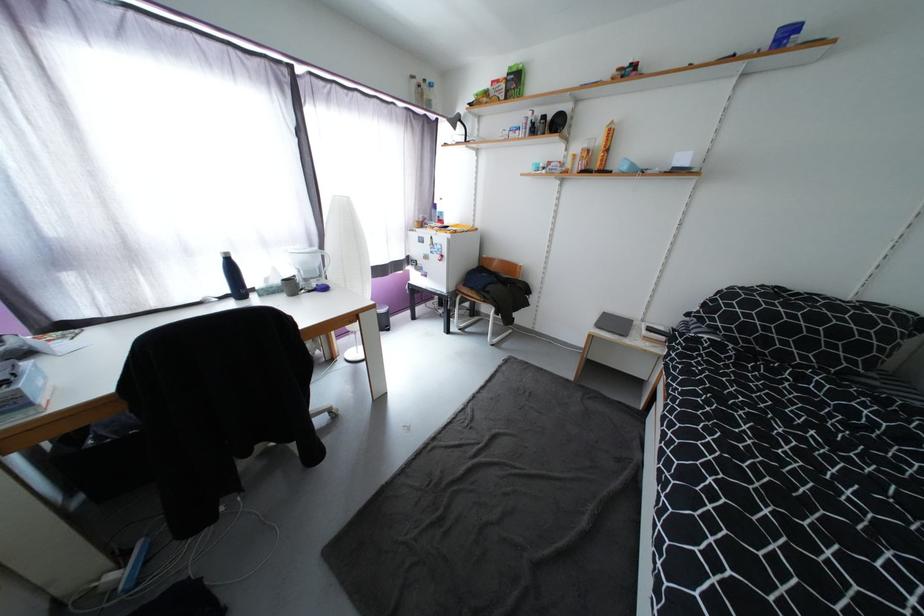
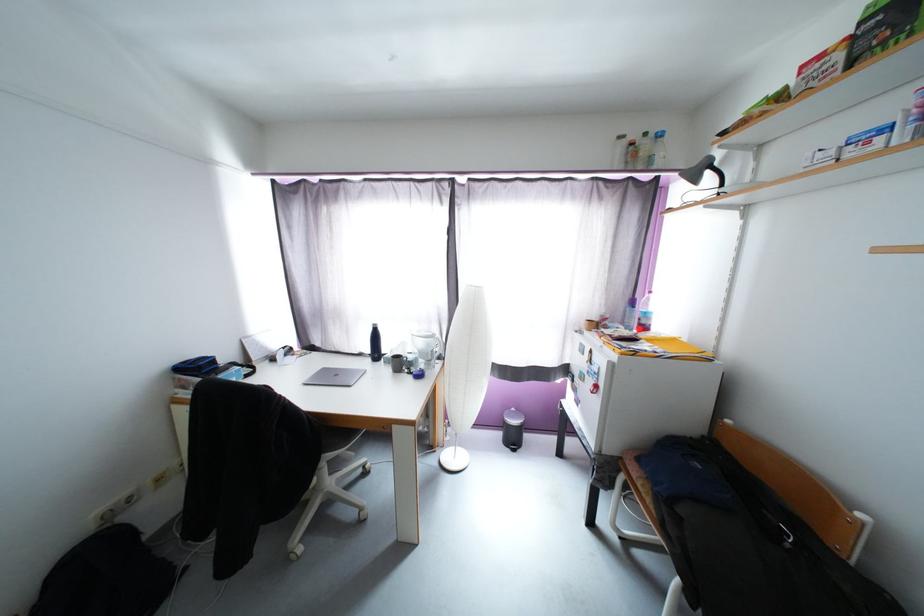
In the second image, find the point that corresponds to point 493,291 in the first image.

(687, 512)